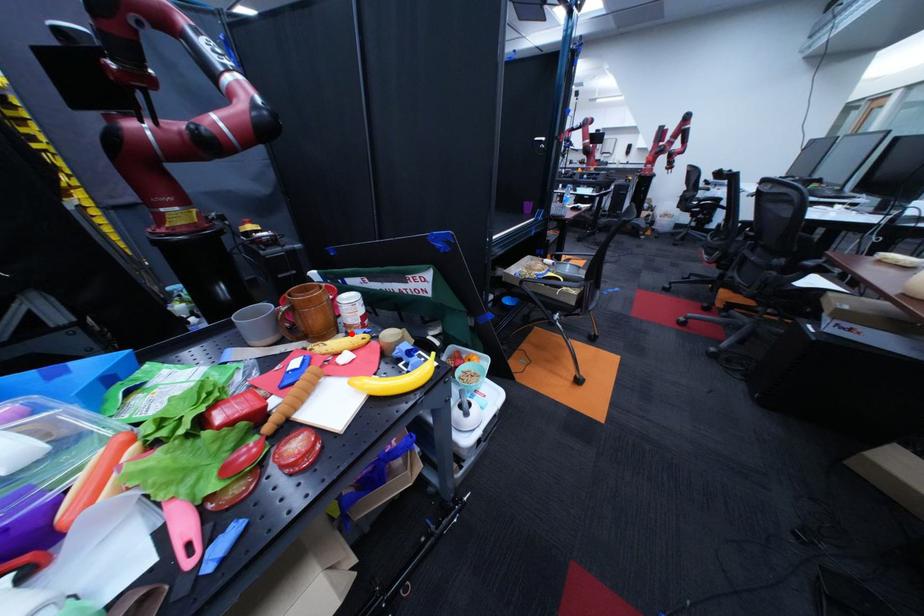
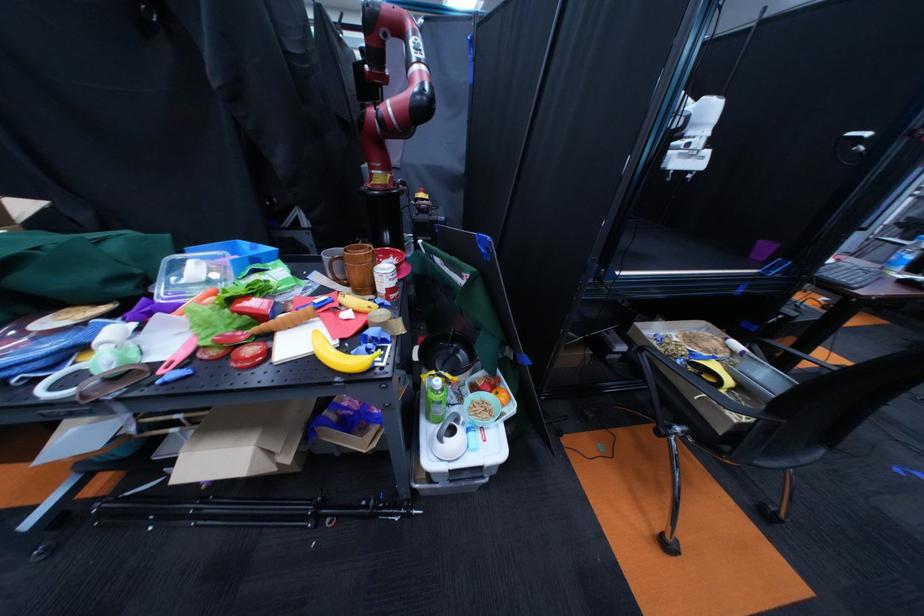
Question: I am providing you with two images of the same scene from different viewpoints. A red point is marked on the first image. At the location where the point appears in image 1, is it still visible in image 2?

Choices:
 (A) Yes
 (B) No

Answer: (A)